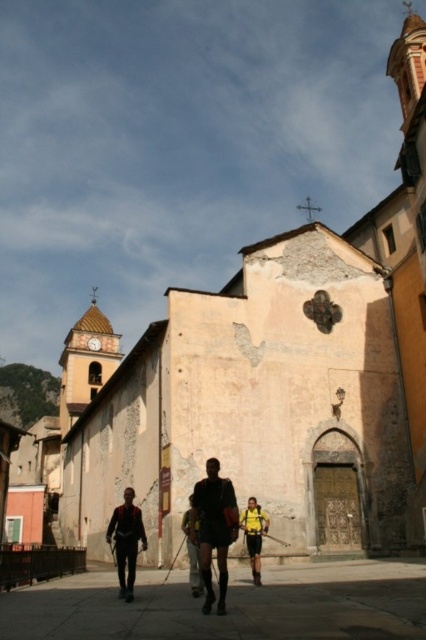
Question: Which object is closer to the camera taking this photo?

Choices:
 (A) matte black backpack at center
 (B) weathered stone church at center
 (C) matte black shorts at center

Answer: (C)

Question: Does weathered stone church at center have a larger size compared to dark gray fabric backpack at center?

Choices:
 (A) yes
 (B) no

Answer: (A)

Question: Among these points, which one is nearest to the camera?

Choices:
 (A) (131, 552)
 (B) (187, 540)
 (C) (348, 570)

Answer: (A)

Question: Considering the relative positions of matte black shorts at center and matte black backpack at center in the image provided, where is matte black shorts at center located with respect to matte black backpack at center?

Choices:
 (A) above
 (B) below

Answer: (A)

Question: Is smooth concrete pavement at center below matte black backpack at center?

Choices:
 (A) no
 (B) yes

Answer: (A)

Question: Which object appears closest to the camera in this image?

Choices:
 (A) matte black shorts at center
 (B) matte black backpack at center
 (C) dark gray fabric backpack at center
 (D) yellow fabric backpack at center

Answer: (A)